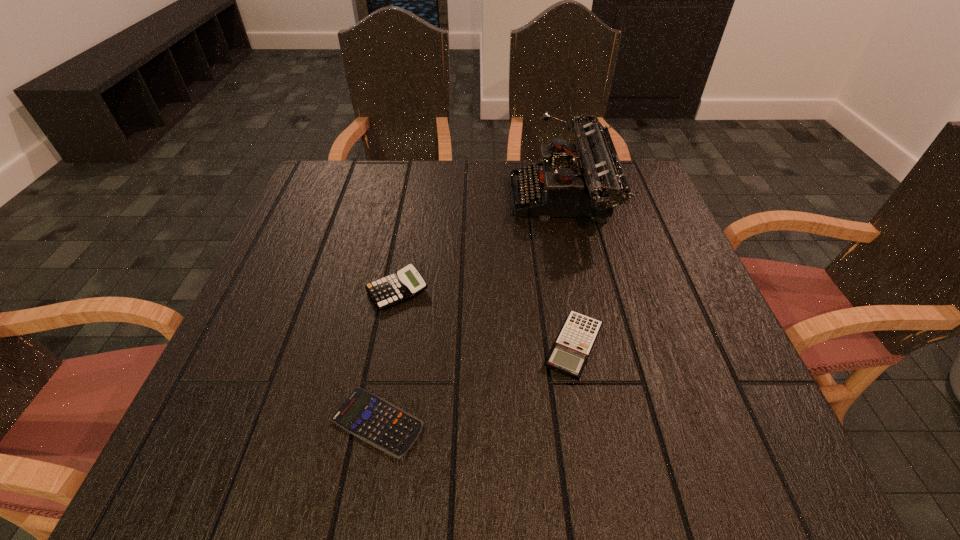
At what (x,y) coordinates should I click in order to perform the action: click on vacant space that satisfies the following two spatial constraints: 1. on the keyboard of the tallest object; 2. on the front side of the tallest calculator. Please return your answer as a coordinate pair (x, y). This screenshot has height=540, width=960. Looking at the image, I should click on (583, 291).

You are a GUI agent. You are given a task and a screenshot of the screen. Output one action in this format:
    pyautogui.click(x=<x>, y=<y>)
    Task: Click on the free spot that satisfies the following two spatial constraints: 1. on the front side of the farthest calculator; 2. on the left side of the third tallest object
    The image size is (960, 540).
    Given the screenshot: What is the action you would take?
    pyautogui.click(x=387, y=346)

The image size is (960, 540). In order to click on free spot that satisfies the following two spatial constraints: 1. on the front side of the farthest calculator; 2. on the left side of the second shortest object in this screenshot , I will do `click(387, 346)`.